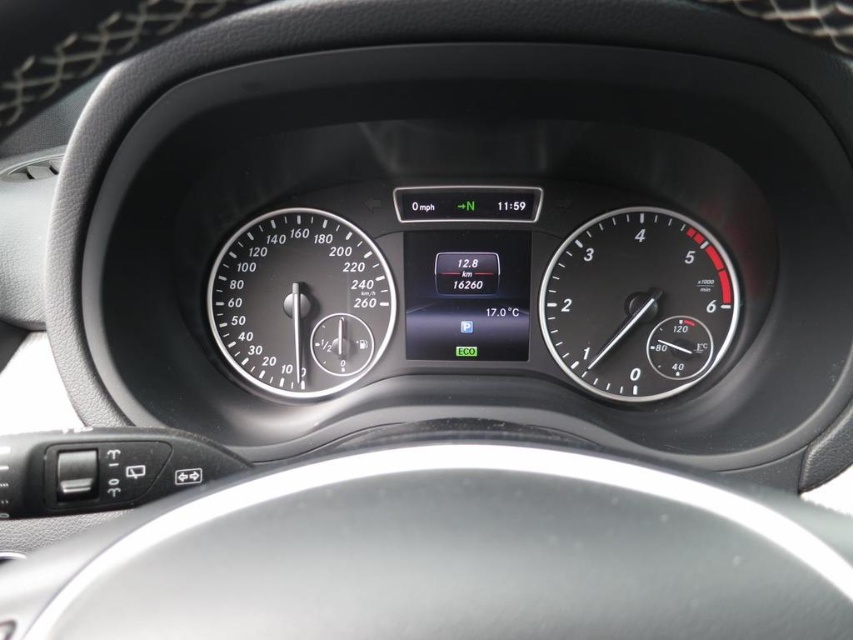
Is the position of black metallic speedometer at center right less distant than that of black glass speedometer at center?

A: That is True.

Which of these two, black metallic speedometer at center right or black glass speedometer at center, stands shorter?

Standing shorter between the two is black glass speedometer at center.

Between point (543, 278) and point (270, 300), which one is positioned in front?

Point (270, 300) is in front.

Where is `black metallic speedometer at center right`? Image resolution: width=853 pixels, height=640 pixels. black metallic speedometer at center right is located at coordinates (637, 304).